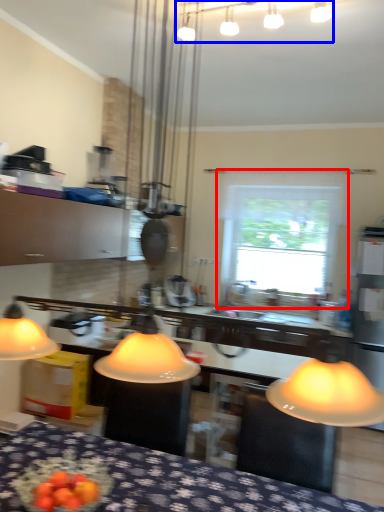
Question: Which point is closer to the camera, window (highlighted by a red box) or lamp (highlighted by a blue box)?

Choices:
 (A) window
 (B) lamp

Answer: (B)